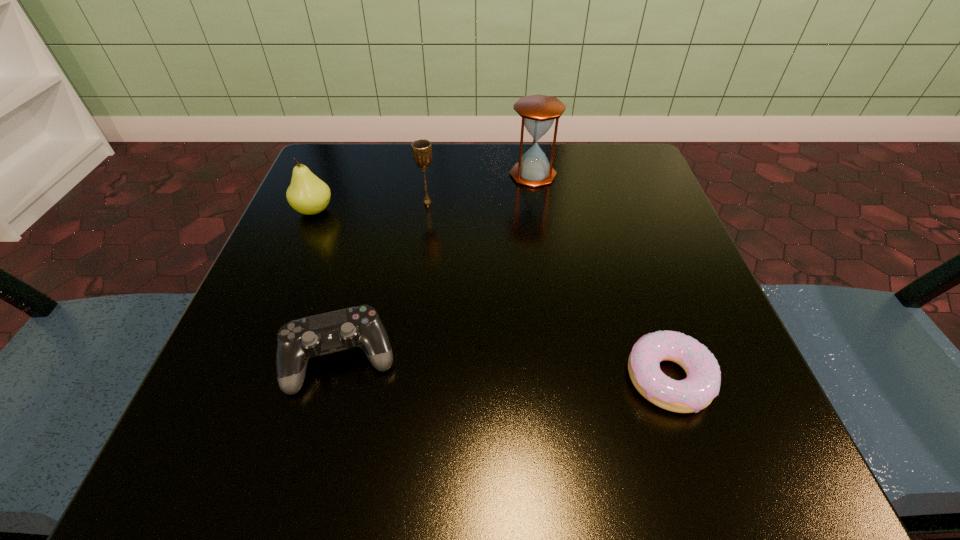
Find the location of a particular element. free space located on the right of the second shortest object is located at coordinates (558, 359).

In order to click on hourglass located at the far edge in this screenshot , I will do `click(538, 112)`.

Locate an element on the screen. chalice that is at the far edge is located at coordinates [421, 149].

Where is `pear that is at the far edge`? The height and width of the screenshot is (540, 960). pear that is at the far edge is located at coordinates (307, 194).

Identify the location of object present at the near edge. The image size is (960, 540). (702, 384).

Locate an element on the screen. The width and height of the screenshot is (960, 540). pear that is positioned at the left edge is located at coordinates (307, 194).

Locate an element on the screen. Image resolution: width=960 pixels, height=540 pixels. control at the left edge is located at coordinates (299, 340).

Locate an element on the screen. The width and height of the screenshot is (960, 540). object at the right edge is located at coordinates (702, 384).

Image resolution: width=960 pixels, height=540 pixels. What are the coordinates of `object at the far left corner` in the screenshot? It's located at (307, 194).

The width and height of the screenshot is (960, 540). Find the location of `object that is at the near right corner`. object that is at the near right corner is located at coordinates (702, 384).